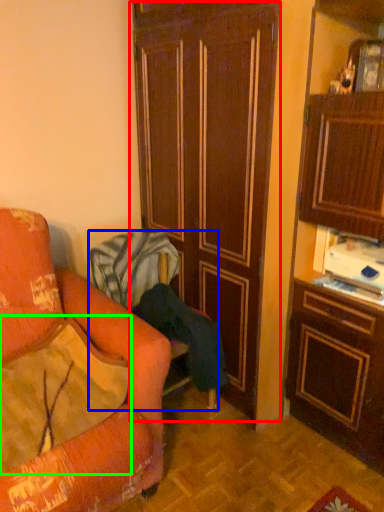
Question: Based on their relative distances, which object is farther from door (highlighted by a red box)? Choose from chair (highlighted by a blue box) and pillow (highlighted by a green box).

Choices:
 (A) chair
 (B) pillow

Answer: (B)